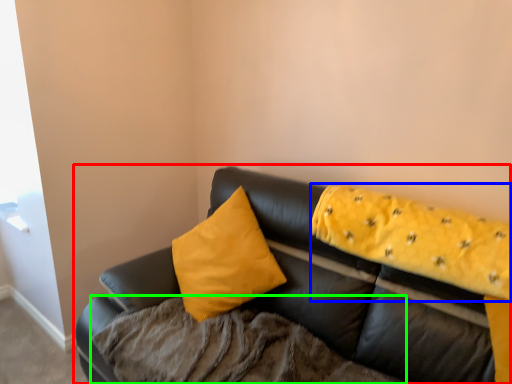
Question: Estimate the real-world distances between objects in this image. Which object is farther from studio couch (highlighted by a red box), blanket (highlighted by a blue box) or bedding (highlighted by a green box)?

Choices:
 (A) blanket
 (B) bedding

Answer: (B)